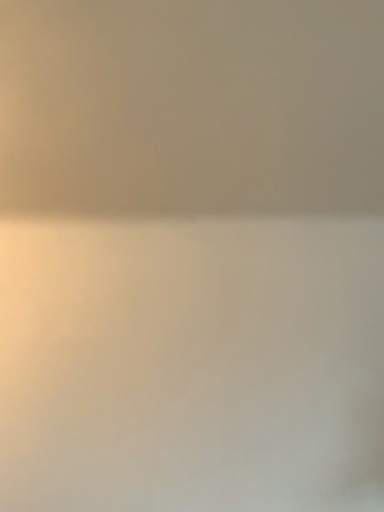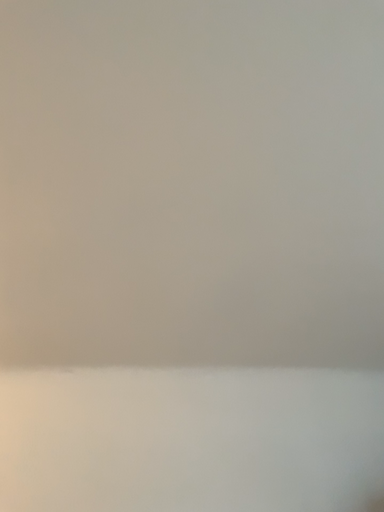
Question: Which way did the camera rotate in the video?

Choices:
 (A) rotated upward
 (B) rotated downward

Answer: (A)